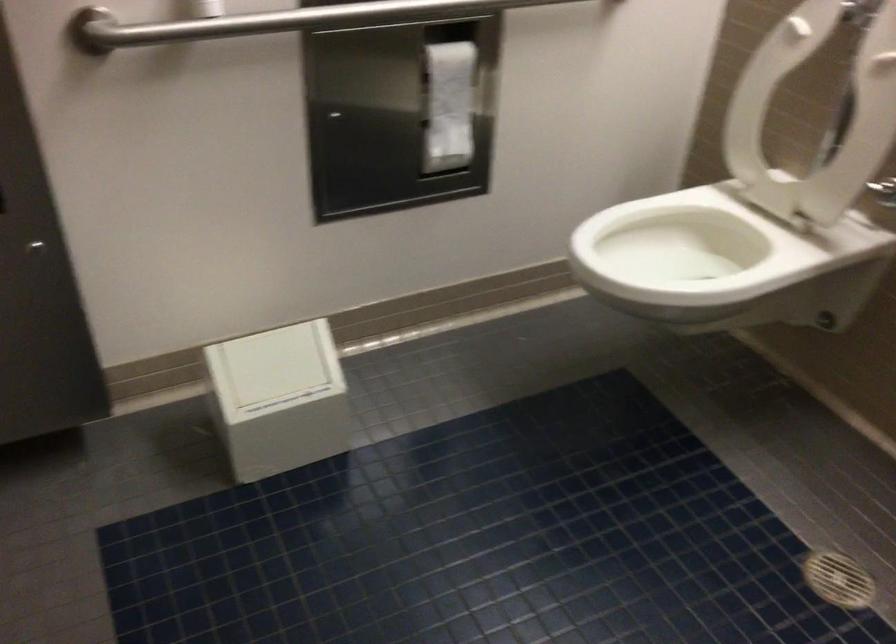
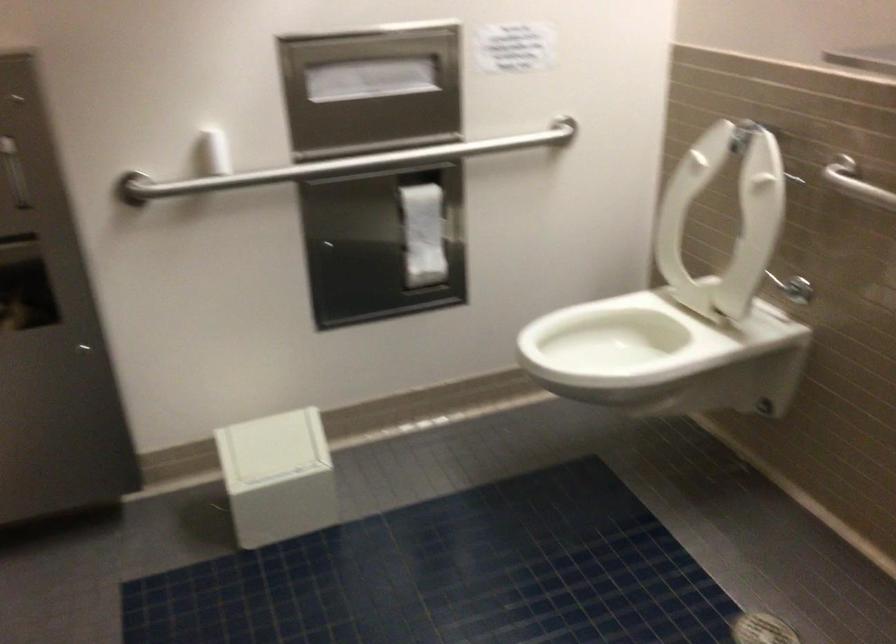
Find the pixel in the second image that matches point 281,402 in the first image.

(278, 477)